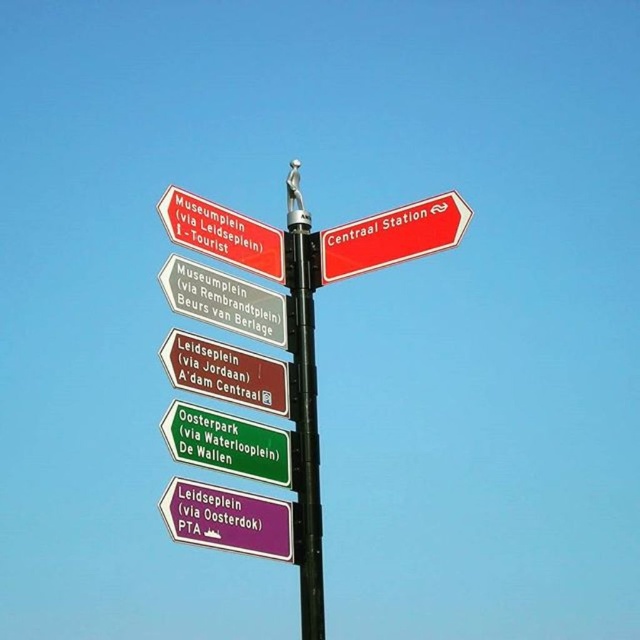
Question: Which object is farther from the camera taking this photo?

Choices:
 (A) black metal pole at center
 (B) green matte signpost at lower center
 (C) matte brown signpost at center
 (D) white plastic sign at center

Answer: (A)

Question: Does red matte sign at upper right have a smaller size compared to matte red signpost at upper center?

Choices:
 (A) no
 (B) yes

Answer: (B)

Question: Which of the following is the farthest from the observer?

Choices:
 (A) red matte sign at upper right
 (B) black metal pole at center
 (C) green matte signpost at lower center

Answer: (A)

Question: Can you confirm if red matte sign at upper right is thinner than matte brown signpost at center?

Choices:
 (A) no
 (B) yes

Answer: (A)

Question: Which object is closer to the camera taking this photo?

Choices:
 (A) green matte signpost at lower center
 (B) white plastic sign at center

Answer: (A)

Question: Considering the relative positions of purple matte sign at lower center and red matte sign at upper right in the image provided, where is purple matte sign at lower center located with respect to red matte sign at upper right?

Choices:
 (A) right
 (B) left

Answer: (B)